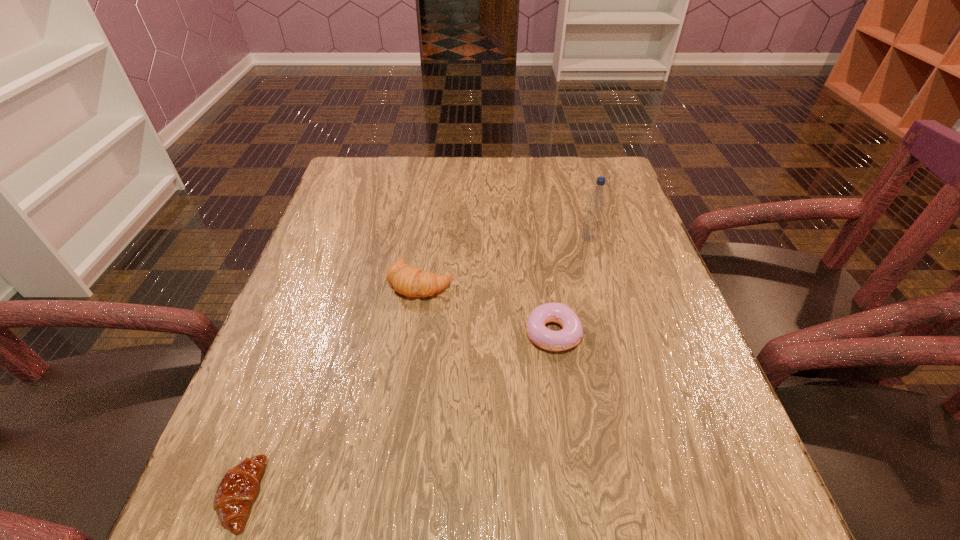
This screenshot has width=960, height=540. Find the location of `free region at the far left corner`. free region at the far left corner is located at coordinates (338, 178).

Where is `vacant area at the far right corner`? This screenshot has height=540, width=960. vacant area at the far right corner is located at coordinates 596,156.

Locate an element on the screen. This screenshot has width=960, height=540. unoccupied position between the second tallest object and the leftmost object is located at coordinates (331, 389).

Locate an element on the screen. Image resolution: width=960 pixels, height=540 pixels. free space between the second shortest object and the water bottle is located at coordinates (571, 286).

The width and height of the screenshot is (960, 540). Identify the location of vacant area that lies between the shortest object and the rightmost object. (415, 367).

Image resolution: width=960 pixels, height=540 pixels. In order to click on vacant area that lies between the nearest object and the farthest object in this screenshot , I will do `click(415, 367)`.

This screenshot has width=960, height=540. What are the coordinates of `free space between the third farthest object and the tallest object` in the screenshot? It's located at (571, 286).

At what (x,y) coordinates should I click in order to perform the action: click on vacant region between the nearer crescent roll and the doughnut. Please return your answer as a coordinate pair (x, y). Image resolution: width=960 pixels, height=540 pixels. Looking at the image, I should click on (397, 414).

You are a GUI agent. You are given a task and a screenshot of the screen. Output one action in this format:
    pyautogui.click(x=<x>, y=<y>)
    Task: Click on the vacant space in between the nearest object and the tallest object
    The image size is (960, 540).
    Given the screenshot: What is the action you would take?
    pyautogui.click(x=415, y=367)

Locate an element on the screen. The image size is (960, 540). free space between the third tallest object and the leftmost object is located at coordinates (397, 414).